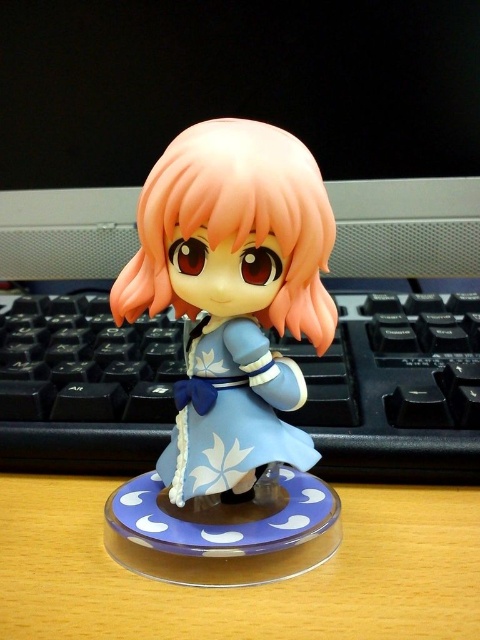
Does black plastic keyboard at center come in front of wooden computer desk at center?

No, black plastic keyboard at center is further to the viewer.

What do you see at coordinates (395, 381) in the screenshot? I see `black plastic keyboard at center` at bounding box center [395, 381].

Identify the location of black plastic keyboard at center. The width and height of the screenshot is (480, 640). (395, 381).

Does point (290, 225) come in front of point (132, 349)?

Yes, it is in front of point (132, 349).

Can you confirm if matte blue figurine at center is thinner than black plastic keyboard at center?

Indeed, matte blue figurine at center has a lesser width compared to black plastic keyboard at center.

Measure the distance between matte blue figurine at center and camera.

They are 57.21 centimeters apart.

The width and height of the screenshot is (480, 640). What are the coordinates of `matte blue figurine at center` in the screenshot? It's located at (229, 355).

Between matte blue figurine at center and wooden computer desk at center, which one appears on the left side from the viewer's perspective?

From the viewer's perspective, wooden computer desk at center appears more on the left side.

Which is behind, point (122, 516) or point (477, 598)?

The point (122, 516) is more distant.

Identify the location of matte blue figurine at center. The image size is (480, 640). (229, 355).